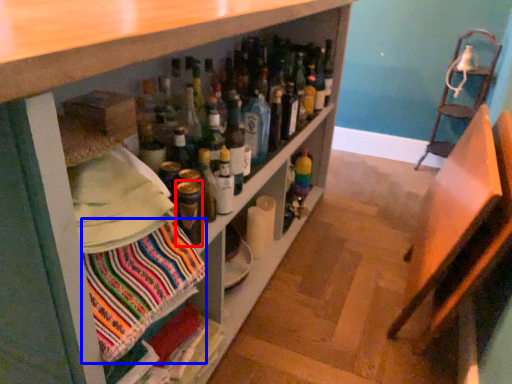
Question: Which of the following is the closest to the observer, bottle (highlighted by a red box) or fabric (highlighted by a blue box)?

Choices:
 (A) bottle
 (B) fabric

Answer: (B)